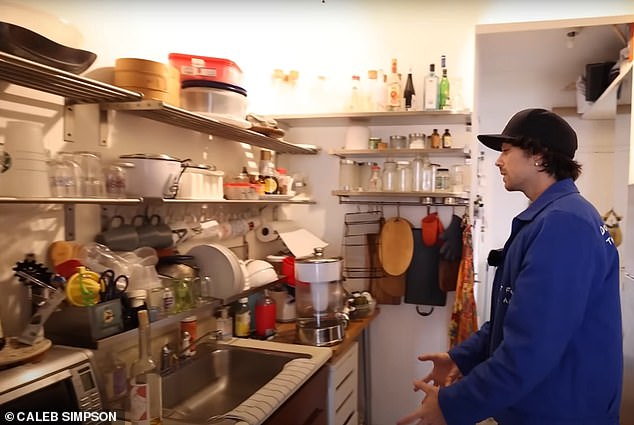
The image size is (634, 425). In order to click on rack in this screenshot , I will do `click(118, 201)`, `click(229, 200)`, `click(84, 85)`, `click(165, 112)`.